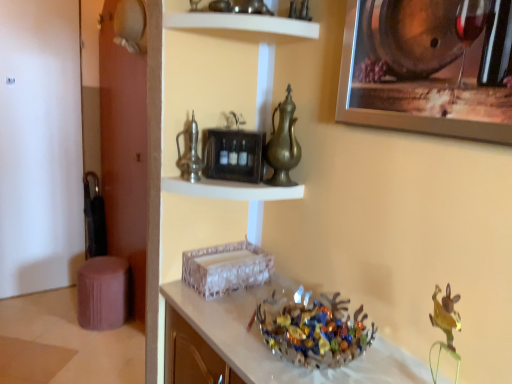
Question: From a real-world perspective, is brass metallic pitcher at center positioned above or below white glossy shelf at upper center, arranged as the 1th shelf when viewed from the top?

Choices:
 (A) above
 (B) below

Answer: (B)

Question: Is brass metallic pitcher at center to the left or to the right of white glossy shelf at upper center, which is counted as the 2th shelf, starting from the bottom, in the image?

Choices:
 (A) right
 (B) left

Answer: (A)

Question: Estimate the real-world distances between objects in this image. Which object is closer to the white glossy shelf at upper center, which is counted as the 2th shelf, starting from the bottom?

Choices:
 (A) metallic silver picture frame at upper right
 (B) purple fabric stool at lower left
 (C) shiny metallic bowl at center
 (D) translucent glass bowl at center
 (E) brass metallic pitcher at center

Answer: (E)

Question: Based on their relative distances, which object is farther from the purple fabric stool at lower left?

Choices:
 (A) translucent glass bowl at center
 (B) shiny metallic bowl at center
 (C) metallic silver picture frame at upper right
 (D) white glossy shelf at upper center, arranged as the 1th shelf when viewed from the top
 (E) metallic silver clock at upper center, which is counted as the 2th shelf, starting from the top

Answer: (C)